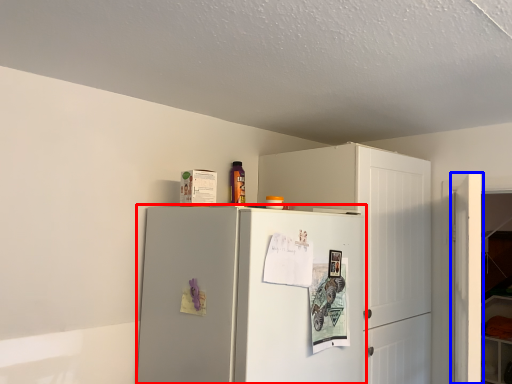
Question: Which object is closer to the camera taking this photo, refrigerator (highlighted by a red box) or door (highlighted by a blue box)?

Choices:
 (A) refrigerator
 (B) door

Answer: (A)